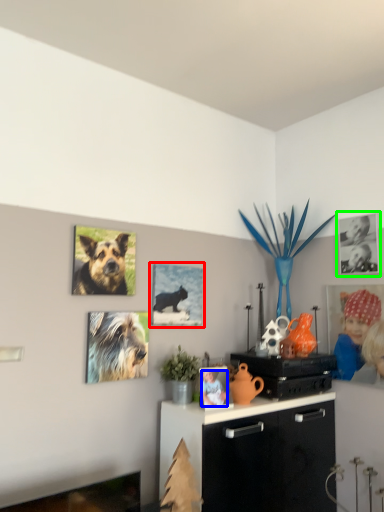
Question: Which is farther away from picture frame (highlighted by a red box)? person (highlighted by a blue box) or picture frame (highlighted by a green box)?

Choices:
 (A) person
 (B) picture frame

Answer: (B)